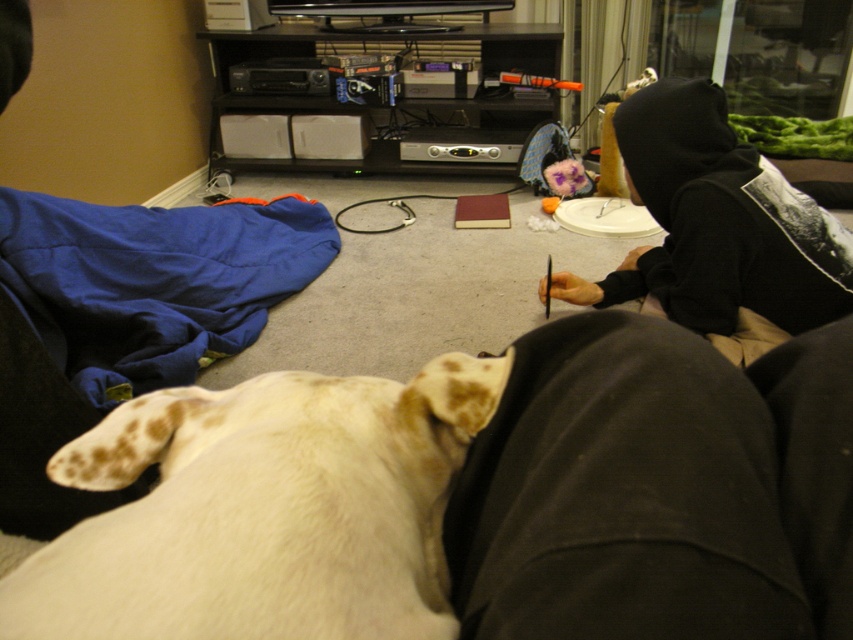
You are trying to reach the black hoodie at upper right but there is a white fur dog at lower left in your way. Can you walk around the dog without stepping over it?

The white fur dog at lower left has a lesser width compared to black hoodie at upper right, so yes, you can walk around the dog since it is narrower than the hoodie.

You are standing in the living room and want to pick up the black hoodie at upper right. Is the white fur dog at lower left blocking your path to it?

The white fur dog at lower left is closer to the viewer than the black hoodie at upper right, so the dog is blocking the path to the hoodie.

You are a delivery robot that needs to place a package between the white fur dog at lower left and the person sitting on the floor. Can you fit the package there if it measures 10 inches in length?

The distance between the white fur dog at lower left and the person sitting on the floor is 10.79 inches, so yes, the package can fit since it is shorter than the available space.